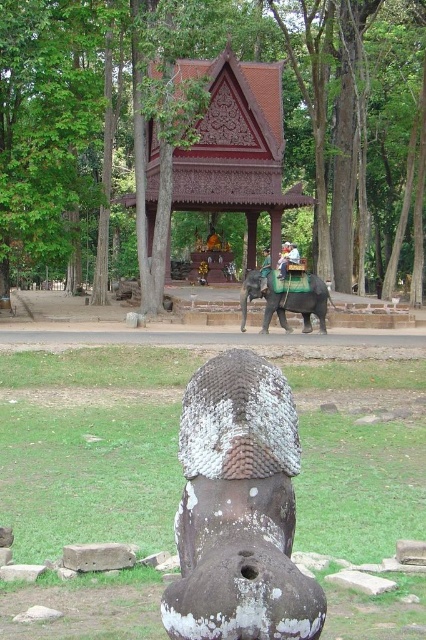
You are a visitor at this historical site and want to take a photo of both the brown wood tree at center and the green fabric cloth at center. Since you want both objects to appear clearly in the frame, which object should you focus on to ensure it doesn not get cut off?

The brown wood tree at center is wider than the green fabric cloth at center, so you should focus on the brown wood tree at center to ensure it fits entirely within the photo frame.